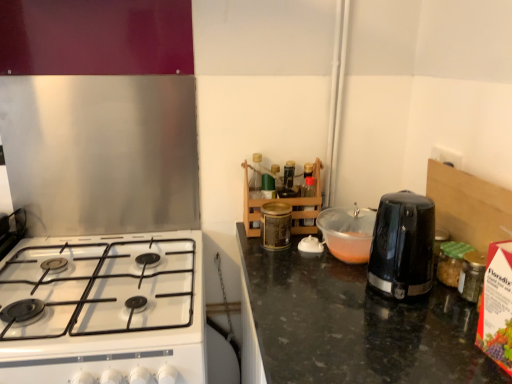
Question: Considering the relative sizes of black plastic toaster at center-right, acting as the 2th kitchen appliance starting from the right, and gold metallic canister at center, which appears as the 1th kitchen appliance when viewed from the left, in the image provided, is black plastic toaster at center-right, acting as the 2th kitchen appliance starting from the right, bigger than gold metallic canister at center, which appears as the 1th kitchen appliance when viewed from the left,?

Choices:
 (A) yes
 (B) no

Answer: (A)

Question: Can you confirm if black plastic toaster at center-right, acting as the 2th kitchen appliance starting from the right, is thinner than gold metallic canister at center, which appears as the 1th kitchen appliance when viewed from the left?

Choices:
 (A) no
 (B) yes

Answer: (A)

Question: Is black plastic toaster at center-right, which appears as the 2th kitchen appliance when viewed from the left, to the left of gold metallic canister at center, which appears as the 1th kitchen appliance when viewed from the left, from the viewer's perspective?

Choices:
 (A) no
 (B) yes

Answer: (A)

Question: From the image's perspective, would you say black plastic toaster at center-right, which appears as the 2th kitchen appliance when viewed from the left, is shown under gold metallic canister at center, which appears as the 1th kitchen appliance when viewed from the left?

Choices:
 (A) no
 (B) yes

Answer: (B)

Question: Is gold metallic canister at center, which appears as the 1th kitchen appliance when viewed from the left, inside black plastic toaster at center-right, which appears as the 2th kitchen appliance when viewed from the left?

Choices:
 (A) yes
 (B) no

Answer: (B)

Question: From a real-world perspective, is gold metallic canister at center, which appears as the 1th kitchen appliance when viewed from the left, physically located above or below black plastic toaster at center-right, acting as the 2th kitchen appliance starting from the right?

Choices:
 (A) above
 (B) below

Answer: (A)

Question: In terms of height, does gold metallic canister at center, which ranks as the 3th kitchen appliance in right-to-left order, look taller or shorter compared to black plastic toaster at center-right, which appears as the 2th kitchen appliance when viewed from the left?

Choices:
 (A) tall
 (B) short

Answer: (A)

Question: Is gold metallic canister at center, which ranks as the 3th kitchen appliance in right-to-left order, situated inside black plastic toaster at center-right, acting as the 2th kitchen appliance starting from the right, or outside?

Choices:
 (A) outside
 (B) inside

Answer: (A)

Question: Considering the positions of point click(282, 241) and point click(338, 210), is point click(282, 241) closer or farther from the camera than point click(338, 210)?

Choices:
 (A) closer
 (B) farther

Answer: (A)

Question: Is white glossy gas stove at lower left in front of or behind black plastic kettle at right, which appears as the 3th kitchen appliance when viewed from the left, in the image?

Choices:
 (A) behind
 (B) front

Answer: (B)

Question: Considering the positions of point (102, 286) and point (419, 236), is point (102, 286) closer or farther from the camera than point (419, 236)?

Choices:
 (A) closer
 (B) farther

Answer: (B)

Question: From the image's perspective, relative to black plastic kettle at right, arranged as the 1th kitchen appliance when viewed from the right, is white glossy gas stove at lower left above or below?

Choices:
 (A) below
 (B) above

Answer: (A)

Question: Considering the positions of white glossy gas stove at lower left and black plastic kettle at right, arranged as the 1th kitchen appliance when viewed from the right, in the image, is white glossy gas stove at lower left taller or shorter than black plastic kettle at right, arranged as the 1th kitchen appliance when viewed from the right,?

Choices:
 (A) short
 (B) tall

Answer: (A)

Question: Considering the positions of gold metallic canister at center, which appears as the 1th kitchen appliance when viewed from the left, and black plastic kettle at right, which appears as the 3th kitchen appliance when viewed from the left, in the image, is gold metallic canister at center, which appears as the 1th kitchen appliance when viewed from the left, wider or thinner than black plastic kettle at right, which appears as the 3th kitchen appliance when viewed from the left,?

Choices:
 (A) wide
 (B) thin

Answer: (B)

Question: Looking at the image, does gold metallic canister at center, which appears as the 1th kitchen appliance when viewed from the left, seem bigger or smaller compared to black plastic kettle at right, arranged as the 1th kitchen appliance when viewed from the right?

Choices:
 (A) big
 (B) small

Answer: (B)